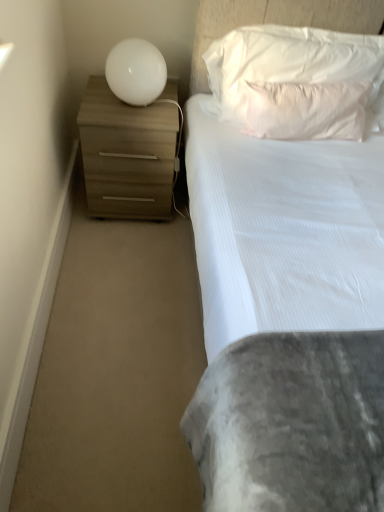
Question: Choose the correct answer: Is white soft pillow at upper center, the first pillow in the top-to-bottom sequence, inside white textured pillow at upper center, the 2th pillow viewed from the top, or outside it?

Choices:
 (A) outside
 (B) inside

Answer: (A)

Question: Is white soft pillow at upper center, the first pillow in the top-to-bottom sequence, bigger or smaller than white textured pillow at upper center, the 1th pillow positioned from the bottom?

Choices:
 (A) big
 (B) small

Answer: (A)

Question: Which of these objects is positioned farthest from the white textured pillow at upper center, the 1th pillow positioned from the bottom?

Choices:
 (A) matte wood chest of drawers at left
 (B) white glossy sphere at upper left
 (C) white soft pillow at upper center, the first pillow in the top-to-bottom sequence

Answer: (A)

Question: Which object is the closest to the white textured pillow at upper center, the 1th pillow positioned from the bottom?

Choices:
 (A) matte wood chest of drawers at left
 (B) white glossy sphere at upper left
 (C) white soft pillow at upper center, placed as the 2th pillow when sorted from bottom to top

Answer: (C)